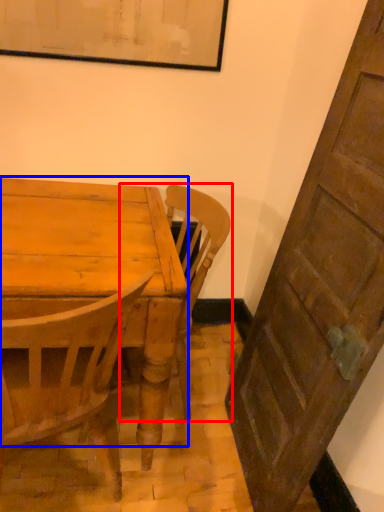
Question: Which point is further to the camera, chair (highlighted by a red box) or table top (highlighted by a blue box)?

Choices:
 (A) chair
 (B) table top

Answer: (A)